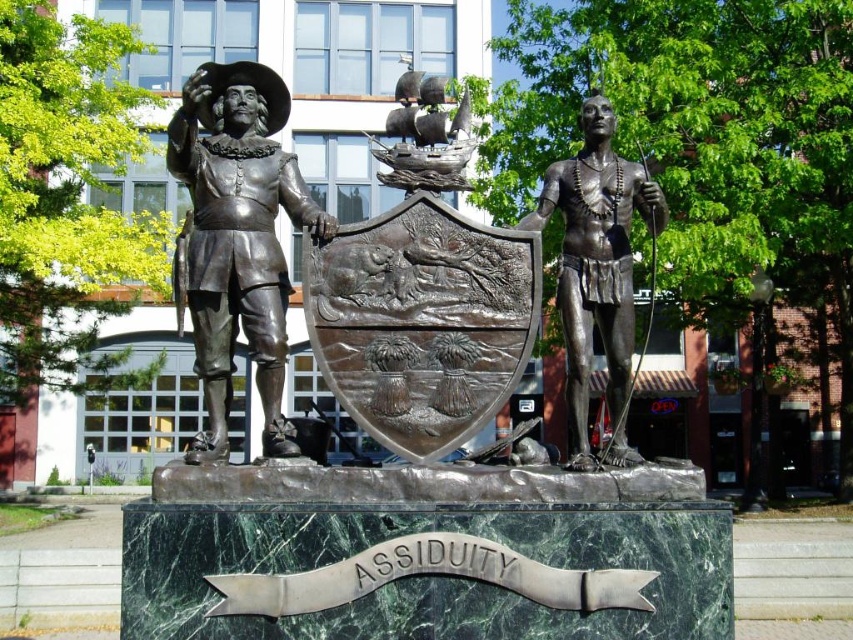
Question: Which point appears farthest from the camera in this image?

Choices:
 (A) (271, 412)
 (B) (614, 390)

Answer: (B)

Question: Which point is closer to the camera?

Choices:
 (A) (524, 218)
 (B) (225, 296)
 (C) (416, 317)

Answer: (C)

Question: Which object appears farthest from the camera in this image?

Choices:
 (A) shiny bronze figure at center
 (B) bronze statue at left
 (C) bronze statue at center

Answer: (C)

Question: Where is bronze statue at center located in relation to shiny bronze figure at center in the image?

Choices:
 (A) below
 (B) above

Answer: (B)

Question: Considering the relative positions of bronze statue at left and shiny bronze figure at center in the image provided, where is bronze statue at left located with respect to shiny bronze figure at center?

Choices:
 (A) right
 (B) left

Answer: (B)

Question: Is bronze statue at center wider than shiny bronze figure at center?

Choices:
 (A) no
 (B) yes

Answer: (A)